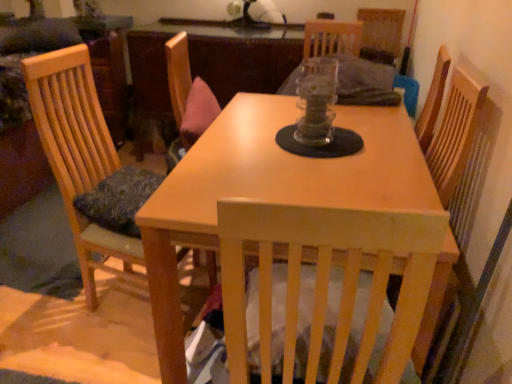
Question: Does point (109, 135) appear closer or farther from the camera than point (232, 122)?

Choices:
 (A) closer
 (B) farther

Answer: (B)

Question: From a real-world perspective, is wooden chair at left physically located above or below light wood table at center?

Choices:
 (A) below
 (B) above

Answer: (B)

Question: Based on their sizes in the image, would you say wooden chair at left is bigger or smaller than light wood table at center?

Choices:
 (A) small
 (B) big

Answer: (A)

Question: From the image's perspective, relative to wooden chair at left, is light wood table at center above or below?

Choices:
 (A) above
 (B) below

Answer: (B)

Question: Is light wood table at center taller or shorter than wooden chair at left?

Choices:
 (A) tall
 (B) short

Answer: (B)

Question: In terms of width, does light wood table at center look wider or thinner when compared to wooden chair at left?

Choices:
 (A) thin
 (B) wide

Answer: (B)

Question: Is point (243, 145) positioned closer to the camera than point (93, 243)?

Choices:
 (A) farther
 (B) closer

Answer: (B)